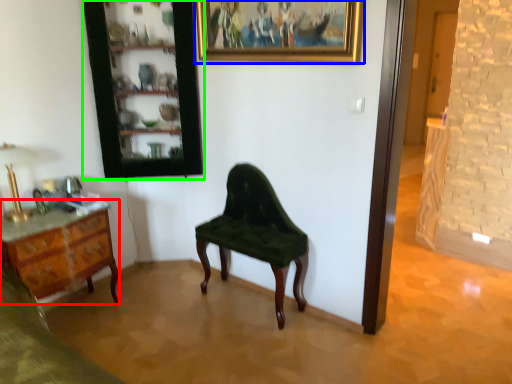
Question: Which is nearer to the desk (highlighted by a red box)? picture frame (highlighted by a blue box) or cabinetry (highlighted by a green box).

Choices:
 (A) picture frame
 (B) cabinetry

Answer: (B)